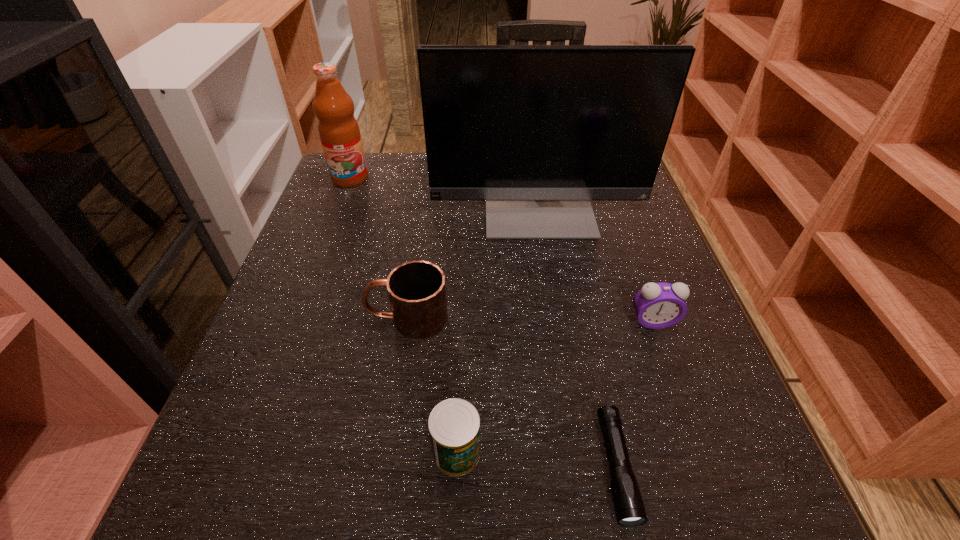
Image resolution: width=960 pixels, height=540 pixels. What are the coordinates of `unoccupied area between the computer monitor and the shortest object` in the screenshot? It's located at (577, 336).

You are a GUI agent. You are given a task and a screenshot of the screen. Output one action in this format:
    pyautogui.click(x=<x>, y=<y>)
    Task: Click on the vacant point located between the shortest object and the mug
    The height and width of the screenshot is (540, 960).
    Given the screenshot: What is the action you would take?
    pyautogui.click(x=512, y=393)

Locate an element on the screen. The height and width of the screenshot is (540, 960). free point between the can and the tallest object is located at coordinates (497, 329).

Where is `free spot between the can and the computer monitor`? free spot between the can and the computer monitor is located at coordinates (497, 329).

Identify the location of free space between the flashlight and the alarm clock. (635, 394).

Identify the location of free space between the can and the flashlight. (537, 460).

The image size is (960, 540). What are the coordinates of `free space between the mug and the can` in the screenshot? It's located at (432, 385).

Identify which object is the fifth closest to the computer monitor. Please provide its 2D coordinates. Your answer should be formatted as a tuple, i.e. [(x, y)], where the tuple contains the x and y coordinates of a point satisfying the conditions above.

[(454, 424)]

Locate which object ranks fourth in proximity to the leftmost object. Please provide its 2D coordinates. Your answer should be formatted as a tuple, i.e. [(x, y)], where the tuple contains the x and y coordinates of a point satisfying the conditions above.

[(657, 305)]

Identify the location of free spot that satisfies the following two spatial constraints: 1. on the front label of the can; 2. on the right side of the fruit juice. (247, 453).